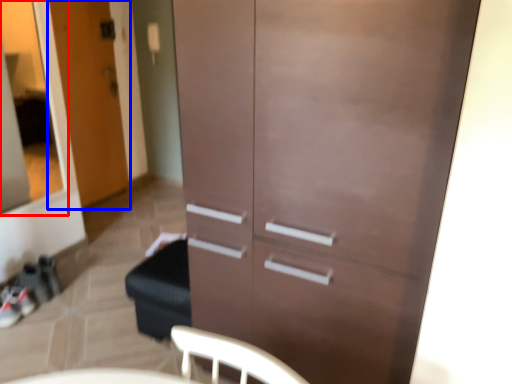
Question: Among these objects, which one is farthest to the camera, glass door (highlighted by a red box) or door (highlighted by a blue box)?

Choices:
 (A) glass door
 (B) door

Answer: (B)